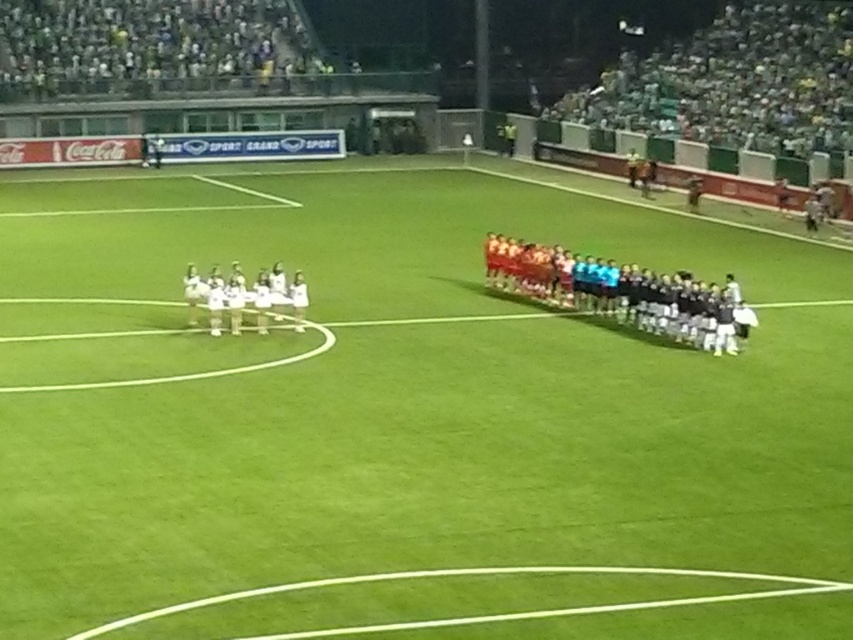
Does orange jersey at center appear under white smooth line at lower center?

Incorrect, orange jersey at center is not positioned below white smooth line at lower center.

Between orange jersey at center and white smooth line at lower center, which one is positioned higher?

Positioned higher is orange jersey at center.

Which is in front, point (599, 275) or point (563, 611)?

Point (563, 611)

Locate an element on the screen. orange jersey at center is located at coordinates (619, 292).

Between green grass field at center and orange jersey at center, which one has more height?

green grass field at center is taller.

What do you see at coordinates (392, 397) in the screenshot? The image size is (853, 640). I see `green grass field at center` at bounding box center [392, 397].

Locate an element on the screen. This screenshot has width=853, height=640. green grass field at center is located at coordinates (392, 397).

Who is taller, green grass field at center or white smooth line at lower center?

green grass field at center is taller.

Does green grass field at center have a greater width compared to white smooth line at lower center?

Yes.

At what (x,y) coordinates should I click in order to perform the action: click on green grass field at center. Please return your answer as a coordinate pair (x, y). Image resolution: width=853 pixels, height=640 pixels. Looking at the image, I should click on (392, 397).